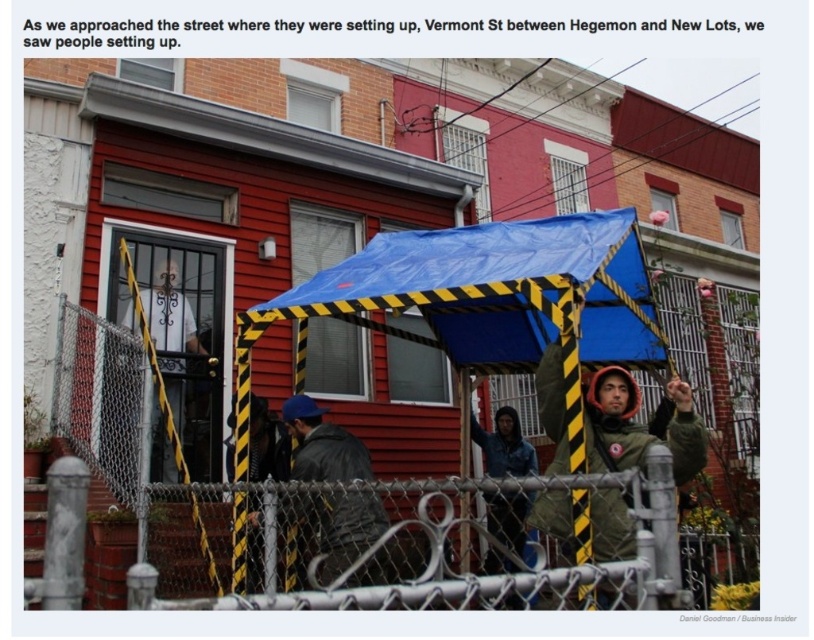
Question: Which object appears closest to the camera in this image?

Choices:
 (A) dark gray jacket at center
 (B) dark gray leather jacket at center
 (C) denim jacket at center
 (D) green matte jacket at center

Answer: (D)

Question: Which point is closer to the camera?

Choices:
 (A) green matte jacket at center
 (B) denim jacket at center

Answer: (A)

Question: Does dark gray leather jacket at center have a smaller size compared to denim jacket at center?

Choices:
 (A) yes
 (B) no

Answer: (A)

Question: Is dark gray leather jacket at center thinner than denim jacket at center?

Choices:
 (A) no
 (B) yes

Answer: (A)

Question: Can you confirm if dark gray leather jacket at center is positioned below dark gray jacket at center?

Choices:
 (A) no
 (B) yes

Answer: (B)

Question: Which of these objects is positioned farthest from the dark gray leather jacket at center?

Choices:
 (A) denim jacket at center
 (B) metal chain-link fence at center

Answer: (A)